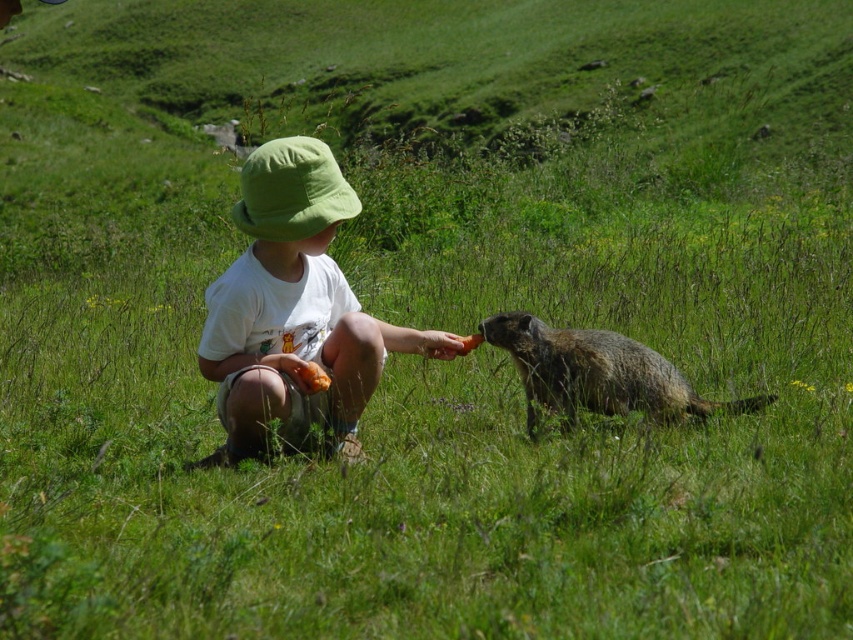
In the scene shown: Does white cotton shirt at center have a greater width compared to green fabric hat at center?

Correct, the width of white cotton shirt at center exceeds that of green fabric hat at center.

Is point (328, 260) closer to viewer compared to point (309, 141)?

That is False.

What are the coordinates of `white cotton shirt at center` in the screenshot? It's located at (294, 310).

Who is more forward, (358, 337) or (527, 348)?

Point (358, 337) is more forward.

Does point (227, 333) lie in front of point (573, 406)?

Yes, it is.

The image size is (853, 640). Identify the location of white cotton shirt at center. (294, 310).

Does brown furry groundhog at lower right come behind green fabric hat at center?

Yes, brown furry groundhog at lower right is further from the viewer.

Does brown furry groundhog at lower right appear over green fabric hat at center?

Incorrect, brown furry groundhog at lower right is not positioned above green fabric hat at center.

Identify the location of brown furry groundhog at lower right. The image size is (853, 640). (598, 372).